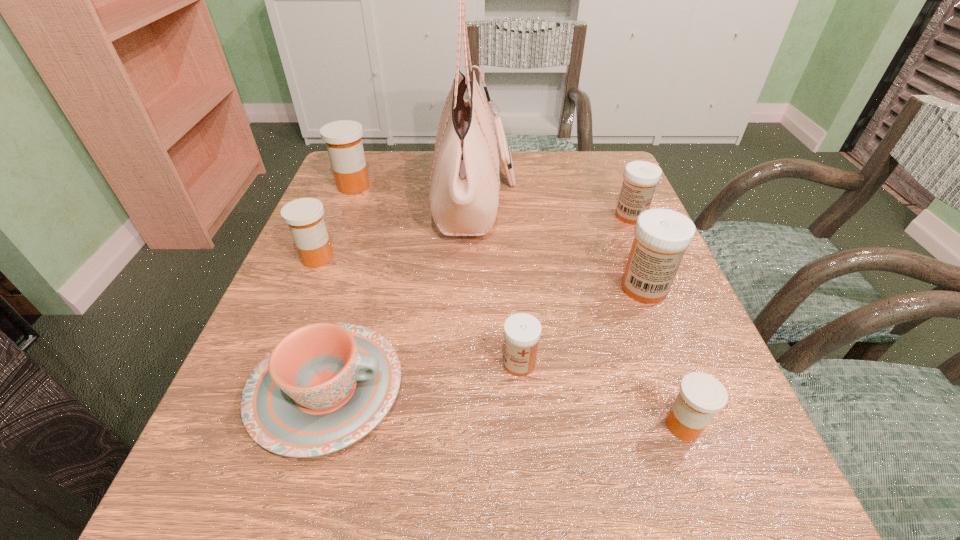
In the image, there is a desktop. Where is `vacant region at the left edge`? The width and height of the screenshot is (960, 540). vacant region at the left edge is located at coordinates (341, 218).

The width and height of the screenshot is (960, 540). What are the coordinates of `free space at the right edge` in the screenshot? It's located at (636, 316).

Locate an element on the screen. The image size is (960, 540). vacant space at the far right corner of the desktop is located at coordinates pyautogui.click(x=570, y=167).

Image resolution: width=960 pixels, height=540 pixels. I want to click on vacant space that's between the nearest white medicine and the second farthest white medicine, so [582, 326].

Find the location of a particular element. free point between the smallest orange medicine and the leftmost white medicine is located at coordinates click(x=601, y=395).

Find the location of a particular element. Image resolution: width=960 pixels, height=540 pixels. blank region between the nearest medicine and the tallest object is located at coordinates (580, 313).

I want to click on free space between the third farthest medicine and the nearest medicine, so click(500, 342).

At what (x,y) coordinates should I click in order to perform the action: click on blank region between the nearest orange medicine and the pink chinaware. Please return your answer as a coordinate pair (x, y). The image size is (960, 540). Looking at the image, I should click on (505, 408).

The image size is (960, 540). Find the location of `empty space that is in between the farthest orange medicine and the second smallest orange medicine`. empty space that is in between the farthest orange medicine and the second smallest orange medicine is located at coordinates (335, 222).

Locate an element on the screen. The image size is (960, 540). vacant space that is in between the third farthest medicine and the farthest medicine is located at coordinates (335, 222).